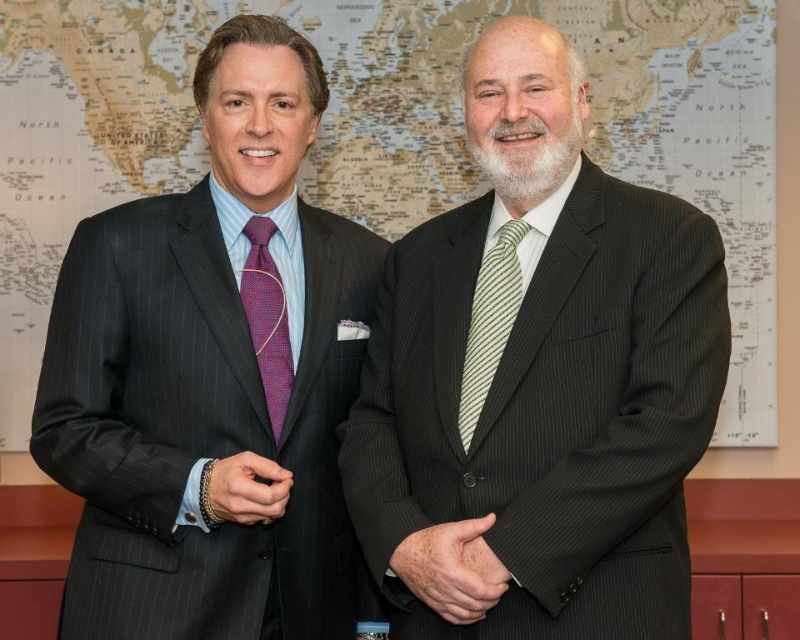
Can you confirm if matte black suit at center is thinner than matte black suit at left?

In fact, matte black suit at center might be wider than matte black suit at left.

Is matte black suit at center behind matte black suit at left?

That is False.

Between point (606, 387) and point (222, 49), which one is positioned behind?

The point (222, 49) is more distant.

Image resolution: width=800 pixels, height=640 pixels. I want to click on matte black suit at center, so click(537, 380).

What are the coordinates of `matte black suit at left` in the screenshot? It's located at (214, 378).

Does matte black suit at left come in front of striped silk tie at center?

Yes.

This screenshot has height=640, width=800. Describe the element at coordinates (214, 378) in the screenshot. I see `matte black suit at left` at that location.

Locate an element on the screen. The width and height of the screenshot is (800, 640). matte black suit at left is located at coordinates (214, 378).

Is point (180, 186) positioned in front of point (458, 417)?

No, it is behind (458, 417).

From the picture: How far apart are map paper at upper center and striped silk tie at center?

map paper at upper center is 1.58 meters away from striped silk tie at center.

Which is behind, point (713, 214) or point (464, 356)?

The point (713, 214) is more distant.

Locate an element on the screen. map paper at upper center is located at coordinates (384, 136).